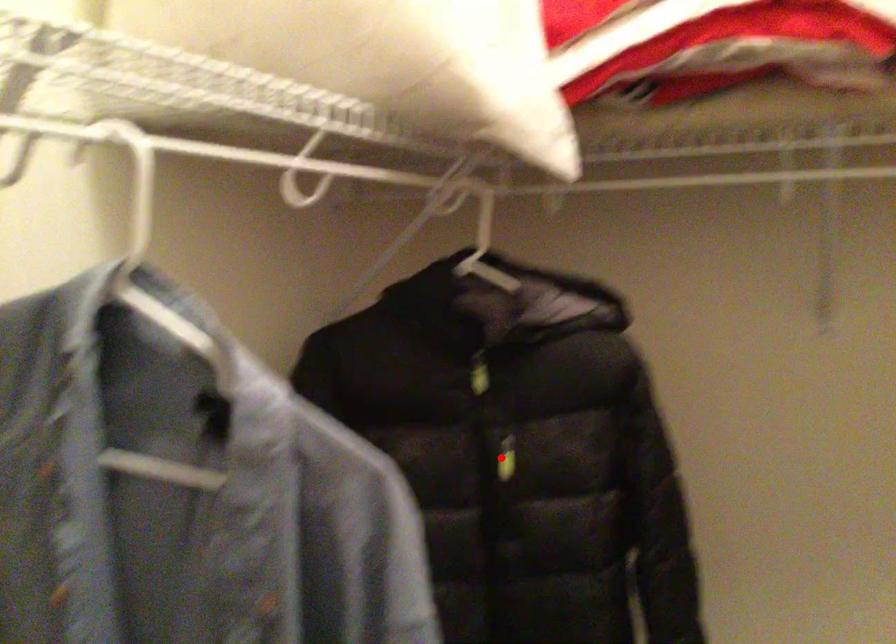
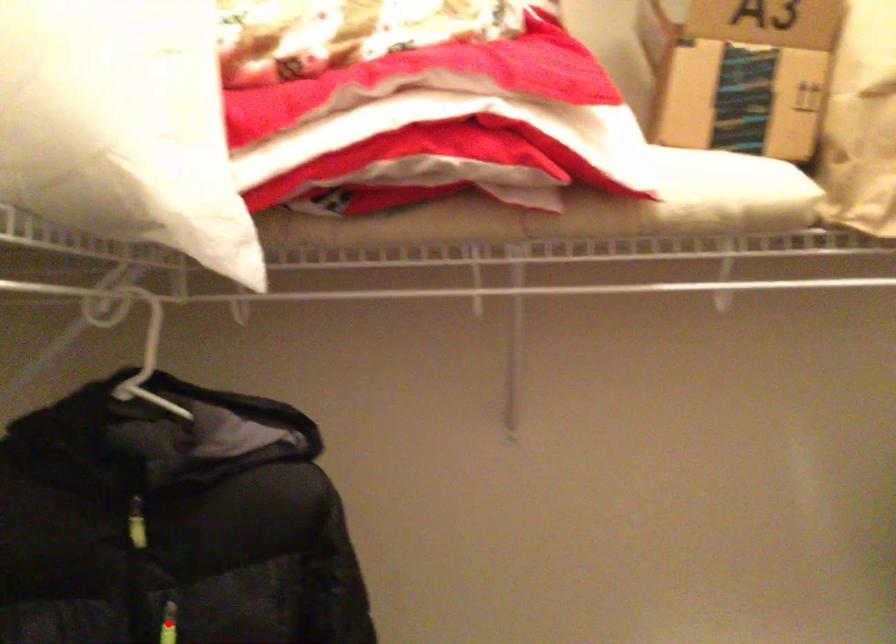
I am providing you with two images of the same scene from different viewpoints. A red point is marked on the first image and another point is marked on the second image. Is the red point in image1 aligned with the point shown in image2?

Yes